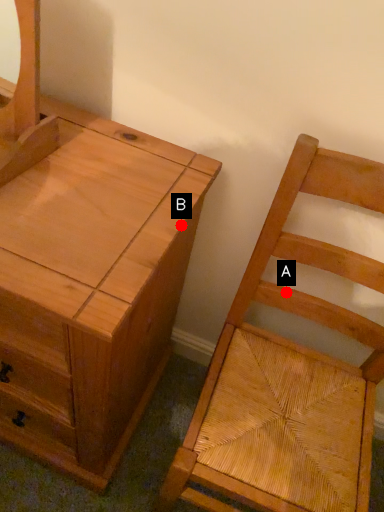
Question: Two points are circled on the image, labeled by A and B beside each circle. Among these points, which one is nearest to the camera?

Choices:
 (A) A is closer
 (B) B is closer

Answer: (B)